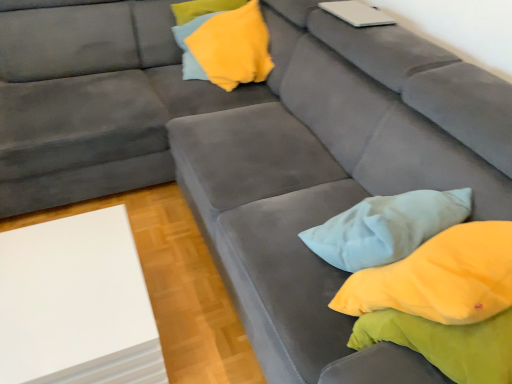
Question: Is the position of white matte laptop at upper right more distant than that of white matte board at lower left?

Choices:
 (A) yes
 (B) no

Answer: (A)

Question: From the image's perspective, does white matte laptop at upper right appear higher than white matte board at lower left?

Choices:
 (A) no
 (B) yes

Answer: (B)

Question: Is white matte laptop at upper right facing towards white matte board at lower left?

Choices:
 (A) yes
 (B) no

Answer: (B)

Question: Considering the relative sizes of white matte laptop at upper right and white matte board at lower left in the image provided, is white matte laptop at upper right thinner than white matte board at lower left?

Choices:
 (A) no
 (B) yes

Answer: (B)

Question: Is white matte board at lower left located within white matte laptop at upper right?

Choices:
 (A) yes
 (B) no

Answer: (B)

Question: From the image's perspective, is white matte laptop at upper right positioned above or below yellow fabric pillow at upper center?

Choices:
 (A) above
 (B) below

Answer: (A)

Question: Is white matte laptop at upper right spatially inside yellow fabric pillow at upper center, or outside of it?

Choices:
 (A) inside
 (B) outside

Answer: (B)

Question: Considering the positions of white matte laptop at upper right and yellow fabric pillow at upper center in the image, is white matte laptop at upper right bigger or smaller than yellow fabric pillow at upper center?

Choices:
 (A) small
 (B) big

Answer: (A)

Question: In the image, is white matte laptop at upper right on the left side or the right side of yellow fabric pillow at upper center?

Choices:
 (A) right
 (B) left

Answer: (A)

Question: Looking at the image, does yellow fabric pillow at upper center seem bigger or smaller compared to white matte laptop at upper right?

Choices:
 (A) small
 (B) big

Answer: (B)

Question: Looking at their shapes, would you say yellow fabric pillow at upper center is wider or thinner than white matte laptop at upper right?

Choices:
 (A) thin
 (B) wide

Answer: (B)

Question: In the image, is yellow fabric pillow at upper center on the left side or the right side of white matte laptop at upper right?

Choices:
 (A) left
 (B) right

Answer: (A)

Question: Does point [x=225, y=26] appear closer or farther from the camera than point [x=359, y=23]?

Choices:
 (A) closer
 (B) farther

Answer: (B)

Question: From a real-world perspective, is yellow fabric pillow at upper center above or below white matte board at lower left?

Choices:
 (A) above
 (B) below

Answer: (A)

Question: Is yellow fabric pillow at upper center spatially inside white matte board at lower left, or outside of it?

Choices:
 (A) outside
 (B) inside

Answer: (A)